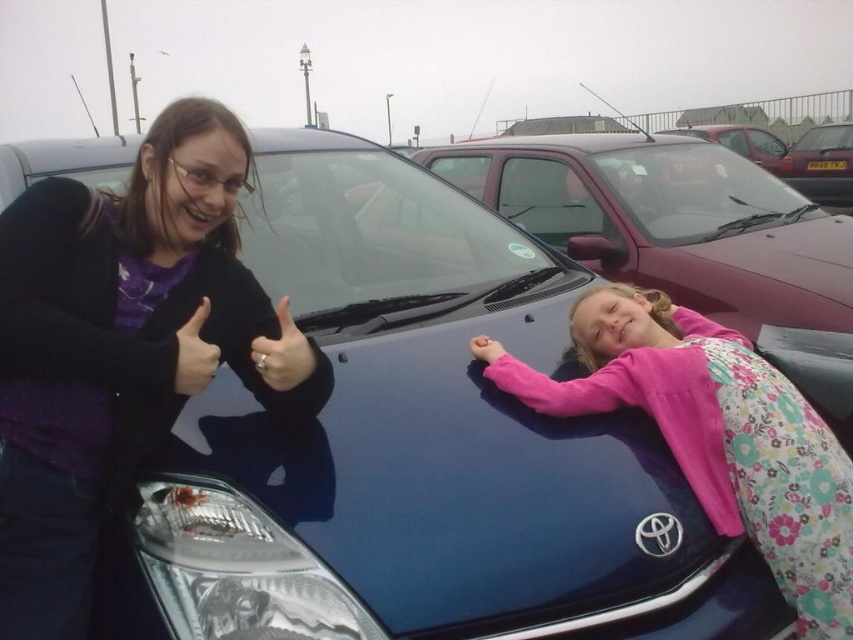
Question: Which object is farther from the camera taking this photo?

Choices:
 (A) matte black jacket at left
 (B) matte black ring at center
 (C) pink floral dress at center
 (D) matte black thumb at center

Answer: (C)

Question: Is matte black jacket at left bigger than pink floral dress at center?

Choices:
 (A) no
 (B) yes

Answer: (A)

Question: Which is farther from the pink floral dress at center?

Choices:
 (A) pink fabric hand at lower right
 (B) matte black ring at center
 (C) matte black jacket at left
 (D) metallic maroon car at right

Answer: (D)

Question: Does matte black thumb at center have a greater width compared to pink fabric hand at lower right?

Choices:
 (A) yes
 (B) no

Answer: (A)

Question: Is pink floral dress at center further to camera compared to matte black ring at center?

Choices:
 (A) no
 (B) yes

Answer: (B)

Question: Which is farther from the matte black thumb at center?

Choices:
 (A) pink floral dress at center
 (B) pink fabric hand at lower right

Answer: (A)